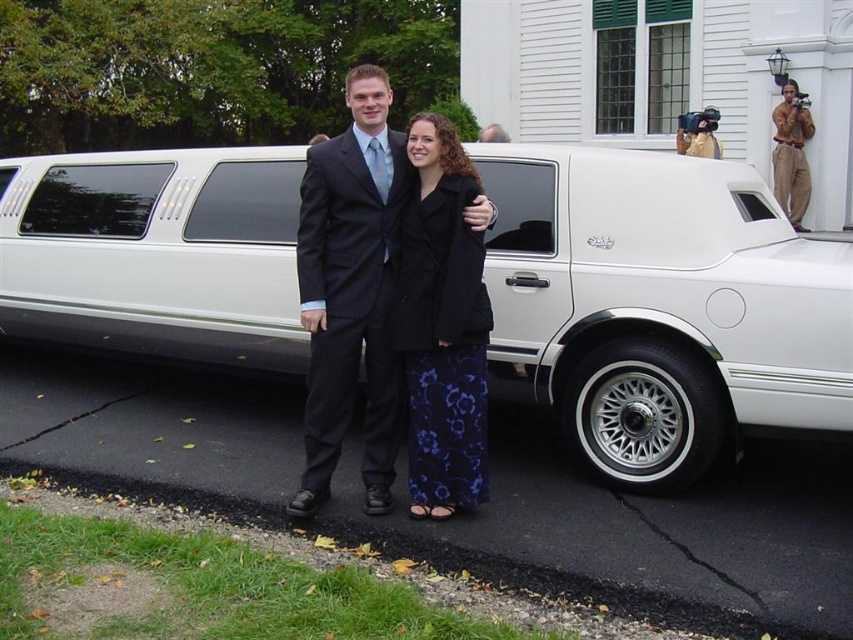
Is white metallic limousine at center smaller than matte black suit at center?

Correct, white metallic limousine at center occupies less space than matte black suit at center.

Does white metallic limousine at center have a larger size compared to matte black suit at center?

Actually, white metallic limousine at center might be smaller than matte black suit at center.

Between point (122, 186) and point (399, 179), which one is positioned behind?

The point (122, 186) is more distant.

Find the location of a particular element. The image size is (853, 640). white metallic limousine at center is located at coordinates (659, 305).

Based on the photo, can you confirm if matte black suit at center is positioned to the left of black matte coat at center?

Yes, matte black suit at center is to the left of black matte coat at center.

Is matte black suit at center to the right of black matte coat at center from the viewer's perspective?

Incorrect, matte black suit at center is not on the right side of black matte coat at center.

What do you see at coordinates (352, 289) in the screenshot?
I see `matte black suit at center` at bounding box center [352, 289].

Identify the location of matte black suit at center. This screenshot has width=853, height=640. (352, 289).

Can you confirm if matte black suit at center is smaller than tan cotton pants at upper right?

Yes, matte black suit at center is smaller than tan cotton pants at upper right.

Looking at this image, does matte black suit at center have a greater width compared to tan cotton pants at upper right?

In fact, matte black suit at center might be narrower than tan cotton pants at upper right.

Who is more forward, [322,428] or [787,180]?

Point [322,428] is in front.

Image resolution: width=853 pixels, height=640 pixels. I want to click on matte black suit at center, so click(352, 289).